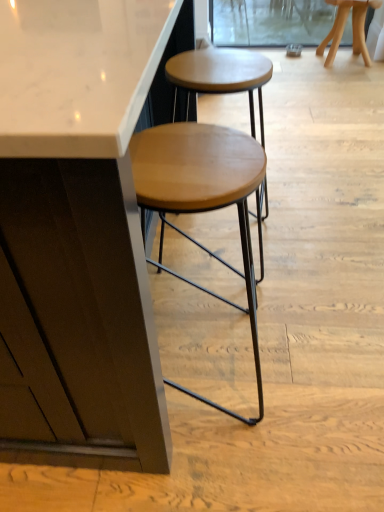
Identify the location of free space on the front side of wooden stool at upper right, positioned as the second stool in bottom-to-top order. (349, 75).